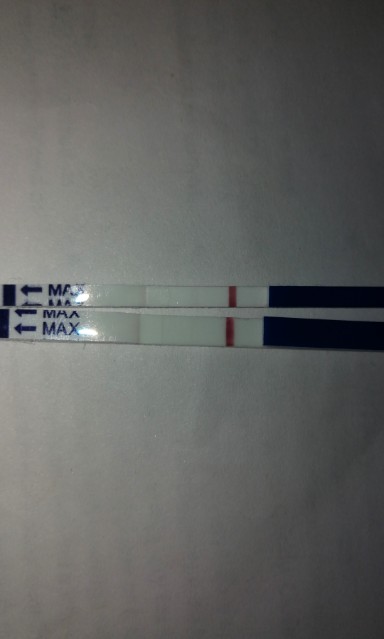
I want to click on wall, so click(131, 203).